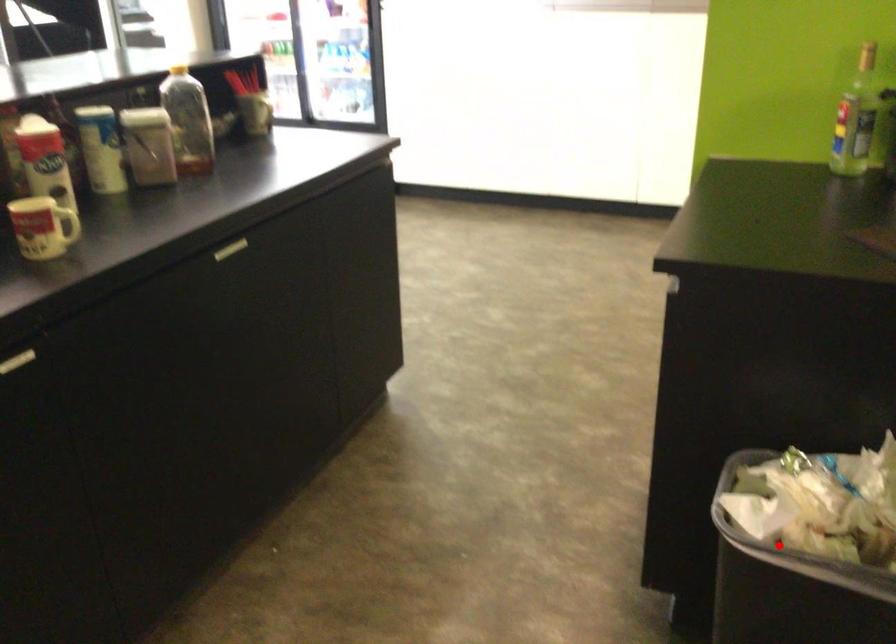
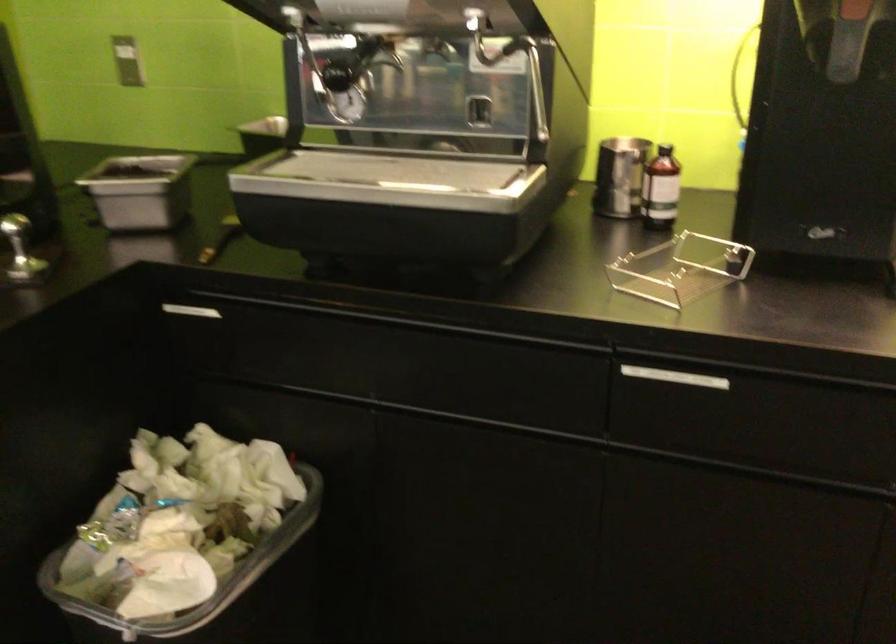
Question: I am providing you with two images of the same scene from different viewpoints. In image1, a red point is highlighted. Considering the same 3D point in image2, which of the following is correct?

Choices:
 (A) It is closer
 (B) It is farther

Answer: (A)